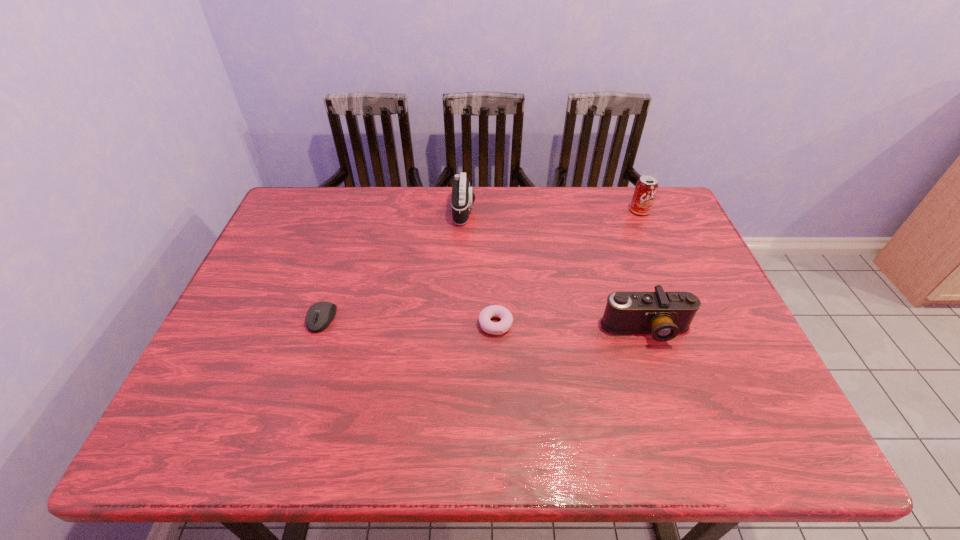
Image resolution: width=960 pixels, height=540 pixels. Find the location of `soda can`. soda can is located at coordinates (646, 188).

I want to click on the fourth object from right to left, so click(x=462, y=199).

Locate an element on the screen. the left camera is located at coordinates (462, 199).

Image resolution: width=960 pixels, height=540 pixels. Identify the location of the nearer camera. (664, 315).

I want to click on the third object from left to right, so click(496, 328).

Identify the location of computer equipment. (325, 311).

Identify the location of free location located on the front of the soda can. The height and width of the screenshot is (540, 960). (681, 307).

You are a GUI agent. You are given a task and a screenshot of the screen. Output one action in this format:
    pyautogui.click(x=<x>, y=<y>)
    Task: Click on the vacant space located on the front lens of the left camera
    The image size is (960, 540).
    Given the screenshot: What is the action you would take?
    pyautogui.click(x=538, y=210)

Locate an element on the screen. The height and width of the screenshot is (540, 960). vacant space located on the lens of the nearer camera is located at coordinates (673, 409).

Image resolution: width=960 pixels, height=540 pixels. In order to click on vacant area situated on the back of the doughnut in this screenshot , I will do `click(492, 216)`.